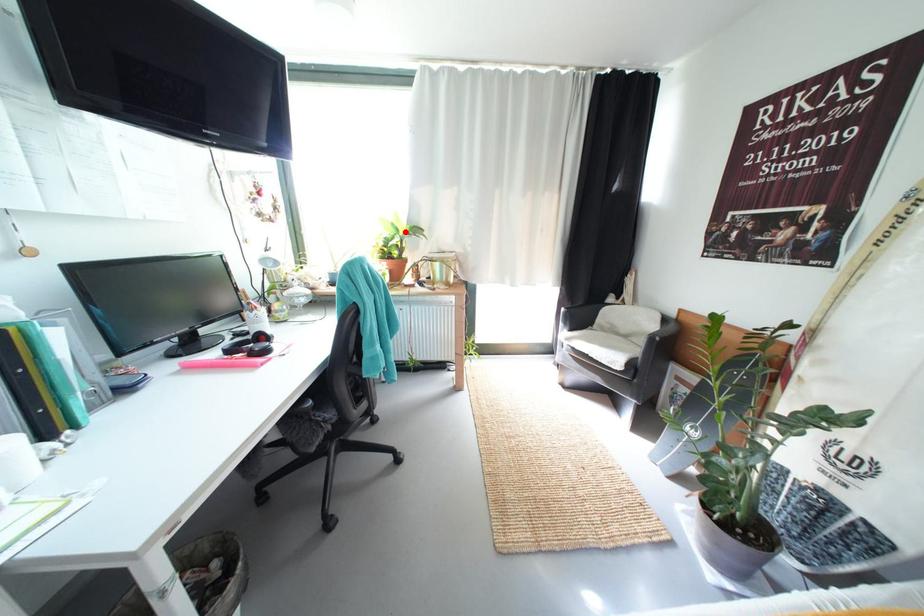
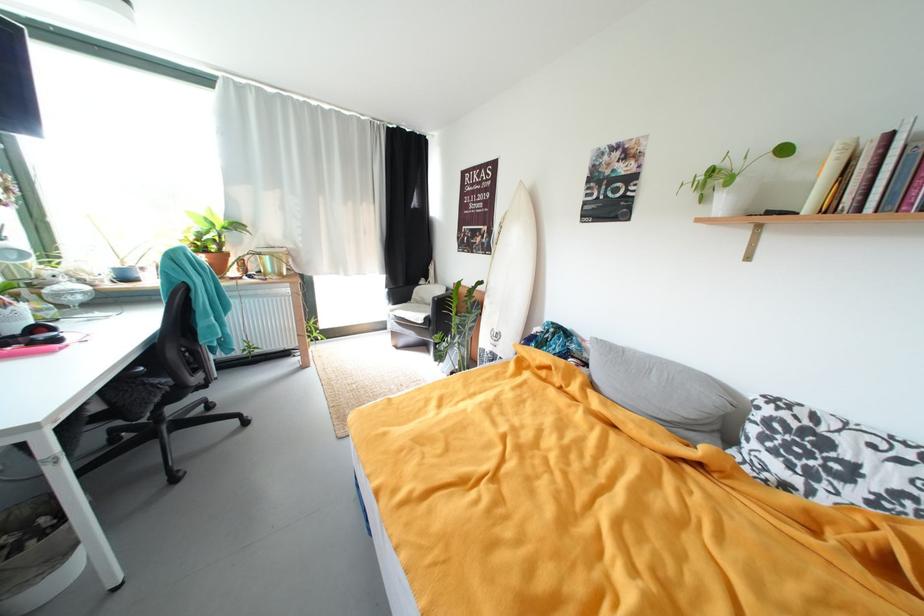
The point at the highlighted location is marked in the first image. Where is the corresponding point in the second image?

(221, 225)